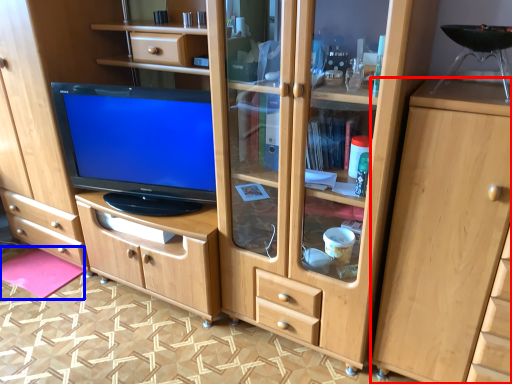
Question: Which of the following is the farthest to the observer, cabinetry (highlighted by a red box) or flat (highlighted by a blue box)?

Choices:
 (A) cabinetry
 (B) flat

Answer: (B)